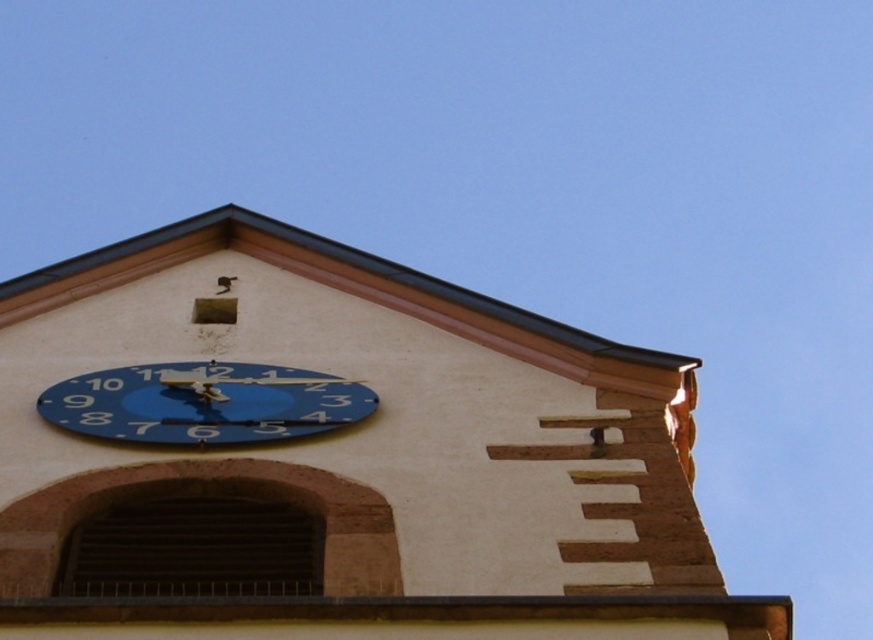
You are standing in front of a building and see the point at coordinates (335, 456). Based on the scene description, what object is located at that point?

The point at coordinates (335, 456) corresponds to the blue painted clock face at upper center.